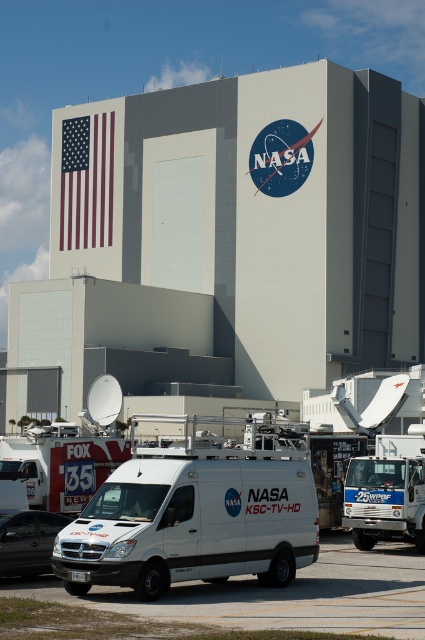
Question: Is white metallic ambulance at center in front of black matte van at lower left?

Choices:
 (A) no
 (B) yes

Answer: (A)

Question: Which point appears farthest from the camera in this image?

Choices:
 (A) (399, 627)
 (B) (303, 448)
 (C) (0, 540)
 (D) (105, 202)

Answer: (D)

Question: Among these objects, which one is nearest to the camera?

Choices:
 (A) white matte van at center
 (B) black matte van at lower left
 (C) white smooth tarmac at lower center
 (D) red-white-and-blue fabric flag at upper left

Answer: (C)

Question: Does white smooth tarmac at lower center have a smaller size compared to black matte van at lower left?

Choices:
 (A) yes
 (B) no

Answer: (B)

Question: Which point is farther to the camera?

Choices:
 (A) (297, 624)
 (B) (359, 529)
 (C) (99, 154)
 (D) (184, 561)

Answer: (C)

Question: Where is white smooth tarmac at lower center located in relation to black matte van at lower left in the image?

Choices:
 (A) below
 (B) above

Answer: (A)